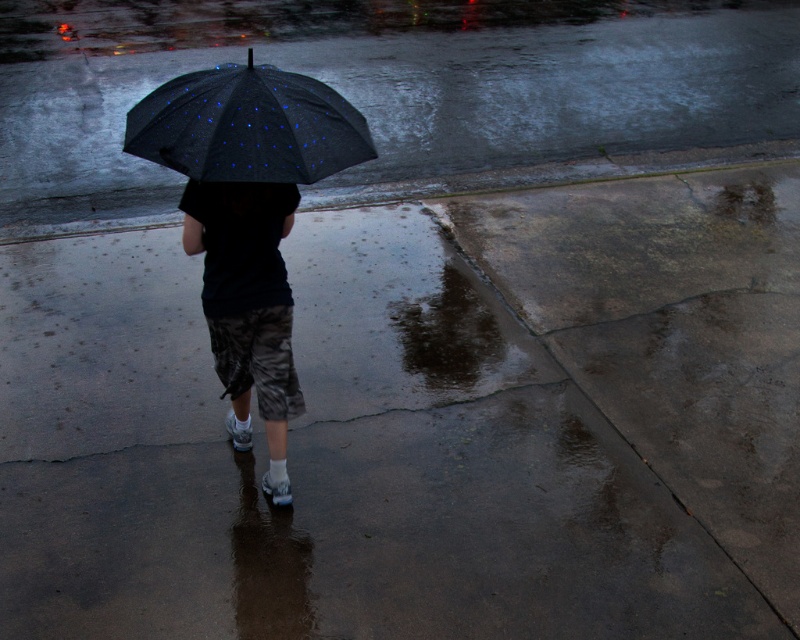
From the picture: Who is more distant from viewer, (190, 195) or (488, 326)?

Positioned behind is point (488, 326).

Which is behind, point (244, 326) or point (417, 348)?

The point (417, 348) is behind.

You are a GUI agent. You are given a task and a screenshot of the screen. Output one action in this format:
    pyautogui.click(x=<x>, y=<y>)
    Task: Click on the camouflage shorts at center
    
    Given the screenshot: What is the action you would take?
    pyautogui.click(x=248, y=307)

Between black matte umbrella at center and glossy concrete puddle at lower center, which one is positioned higher?

black matte umbrella at center

Who is more forward, (362, 115) or (432, 355)?

Point (362, 115) is in front.

Is point (176, 120) closer to camera compared to point (458, 376)?

Yes, it is in front of point (458, 376).

Where is `black matte umbrella at center`? This screenshot has height=640, width=800. black matte umbrella at center is located at coordinates (248, 125).

Is point (262, 237) positioned behind point (270, 138)?

Yes, it is.

Who is more distant from viewer, (264, 236) or (281, 88)?

The point (264, 236) is behind.

Locate an element on the screen. This screenshot has width=800, height=640. camouflage shorts at center is located at coordinates (248, 307).